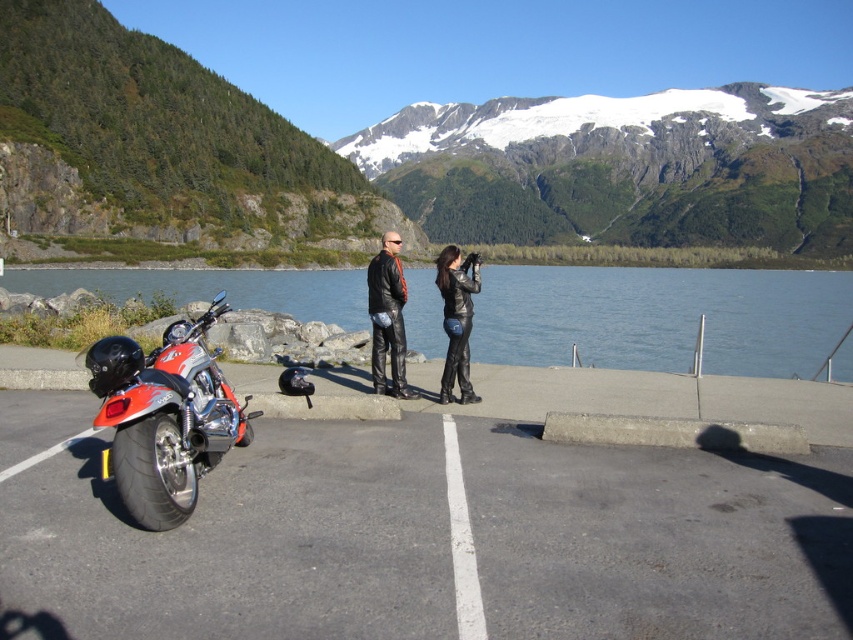
You are planning to take a photo of the clear water at center and the leather jacket at center. Which object should you zoom in more on to ensure both are in focus?

You should zoom in more on the clear water at center because its width is larger than the leather jacket at center, so it requires a closer focus to capture details.

You are planning to set up a picnic area in the scenic outdoor setting. Given the presence of the smooth asphalt parking lot at lower left and the clear water at center, which location would be more suitable for placing a large picnic blanket without obstructing the view of the mountains?

The clear water at center has a larger size compared to the smooth asphalt parking lot at lower left, making it more suitable for placing a large picnic blanket while maintaining an unobstructed view of the mountains.